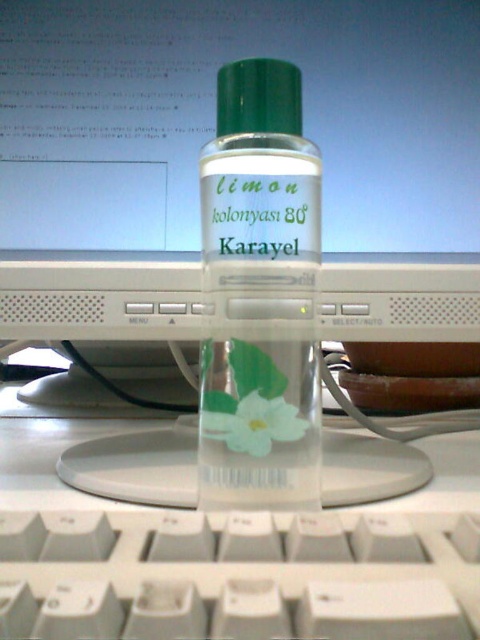
Question: Which of the following is the closest to the observer?

Choices:
 (A) (55, 566)
 (B) (248, 180)
 (C) (214, 426)

Answer: (A)

Question: Which of the following is the closest to the observer?

Choices:
 (A) white plastic keyboard at bottom
 (B) transparent plastic bottle at center
 (C) white paper flower at center

Answer: (A)

Question: Which point is farther to the camera?

Choices:
 (A) white paper flower at center
 (B) white plastic keyboard at bottom
 (C) transparent plastic bottle at center

Answer: (A)

Question: Is white plastic keyboard at bottom to the left of transparent plastic bottle at center from the viewer's perspective?

Choices:
 (A) no
 (B) yes

Answer: (B)

Question: Can you confirm if transparent plastic bottle at center is positioned below white paper flower at center?

Choices:
 (A) yes
 (B) no

Answer: (B)

Question: From the image, what is the correct spatial relationship of white plastic keyboard at bottom in relation to white paper flower at center?

Choices:
 (A) left
 (B) right

Answer: (A)